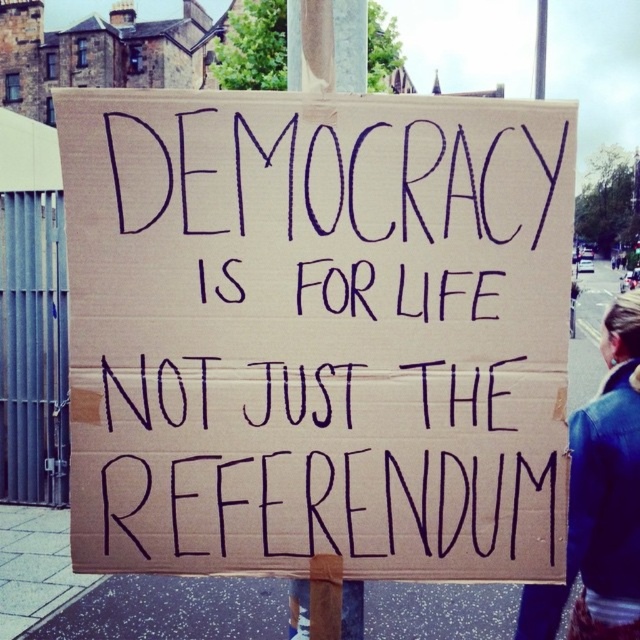
You are a photographer trying to capture the brown cardboard sign at center and the wooden post at center in a single shot. Based on their positions, which object would appear closer to the camera in the photo?

The brown cardboard sign at center appears closer to the camera because it is in front of the wooden post at center.

You are a delivery person trying to place a 15 inch wide box between the brown cardboard sign at center and the wooden post at center. Can the box fit in the space between them?

The distance between the brown cardboard sign at center and the wooden post at center is 14.85 inches. Since the box is 15 inches wide, it cannot fit in the space between them as the available space is slightly smaller than the box.